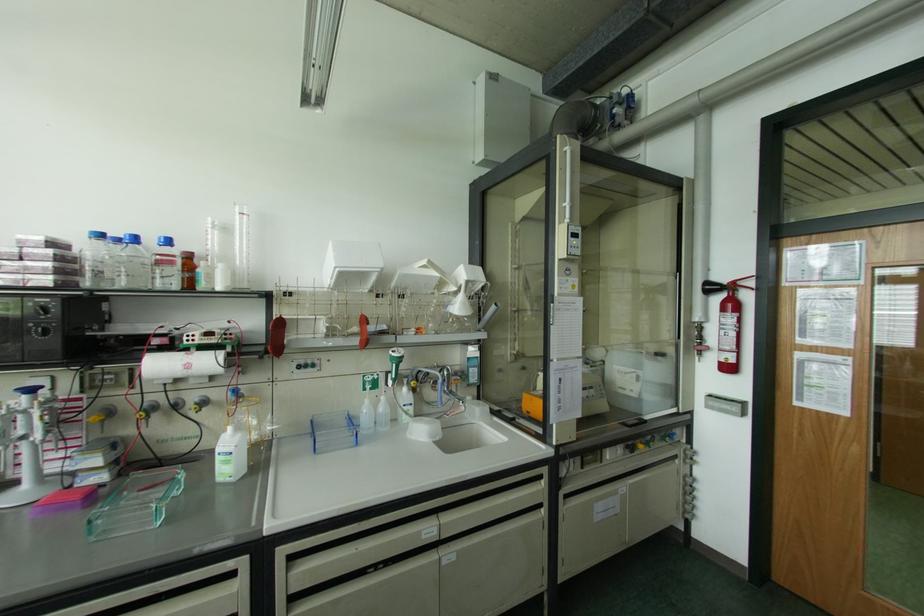
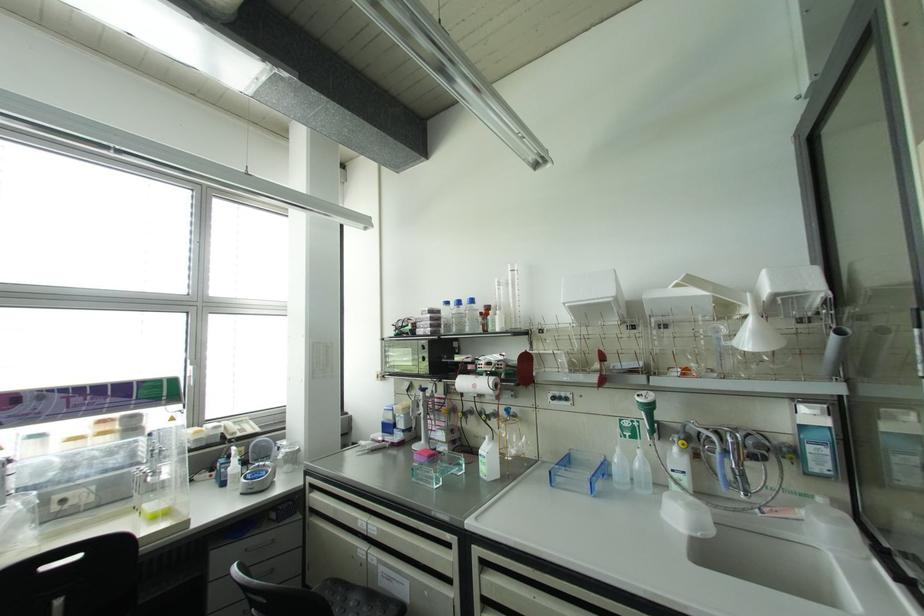
Question: I am providing you with two images of the same scene from different viewpoints. After the viewpoint changes to image2, which objects are now occluded?

Choices:
 (A) white paper roll
 (B) bottle with blue cap
 (C) chrome faucet handle
 (D) none of these

Answer: (D)